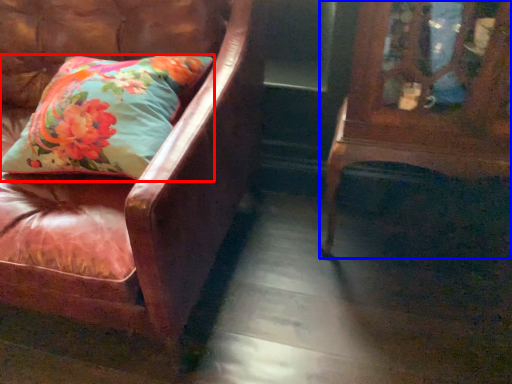
Question: Which object appears farthest to the camera in this image, pillow (highlighted by a red box) or furniture (highlighted by a blue box)?

Choices:
 (A) pillow
 (B) furniture

Answer: (A)